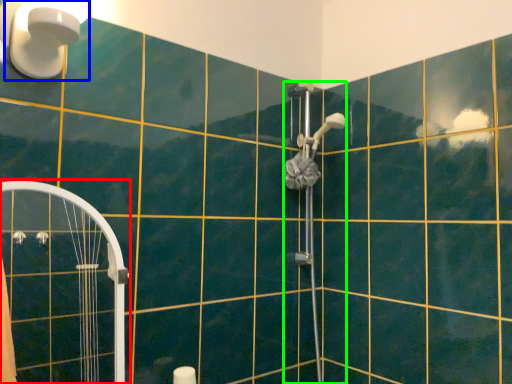
Question: Which is nearer to the shower door (highlighted by a red box)? light fixture (highlighted by a blue box) or shower (highlighted by a green box).

Choices:
 (A) light fixture
 (B) shower

Answer: (A)